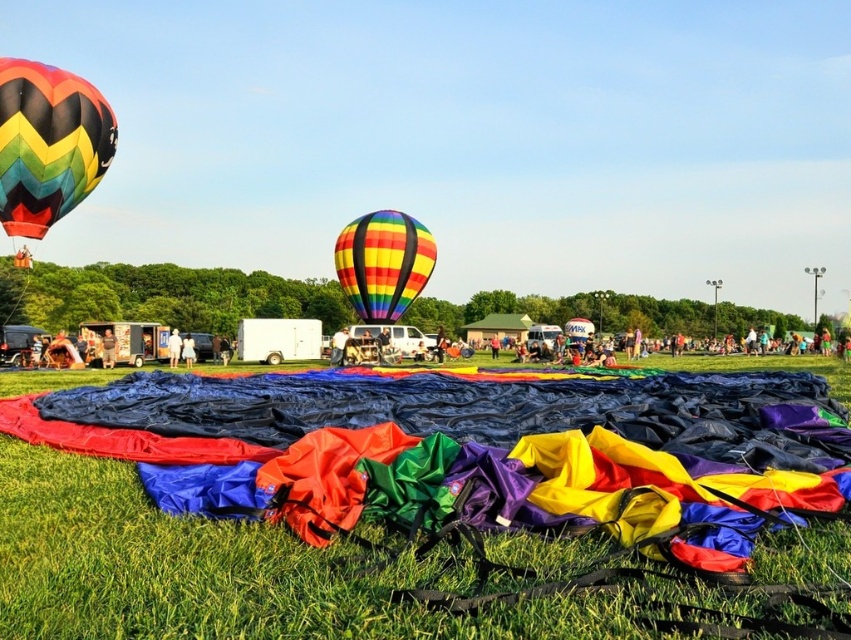
Question: Among these points, which one is farthest from the camera?

Choices:
 (A) (347, 278)
 (B) (381, 586)

Answer: (A)

Question: Does green grass at lower center have a lesser width compared to rainbow striped hot air balloon at upper left?

Choices:
 (A) no
 (B) yes

Answer: (A)

Question: Which object is positioned farthest from the rainbow striped hot air balloon at upper left?

Choices:
 (A) green grass at lower center
 (B) rainbow striped balloon at center

Answer: (B)

Question: Which object is the closest to the green grass at lower center?

Choices:
 (A) rainbow striped hot air balloon at upper left
 (B) rainbow striped balloon at center

Answer: (A)

Question: Can you confirm if green grass at lower center is wider than rainbow striped hot air balloon at upper left?

Choices:
 (A) yes
 (B) no

Answer: (A)

Question: Does green grass at lower center appear under rainbow striped balloon at center?

Choices:
 (A) no
 (B) yes

Answer: (B)